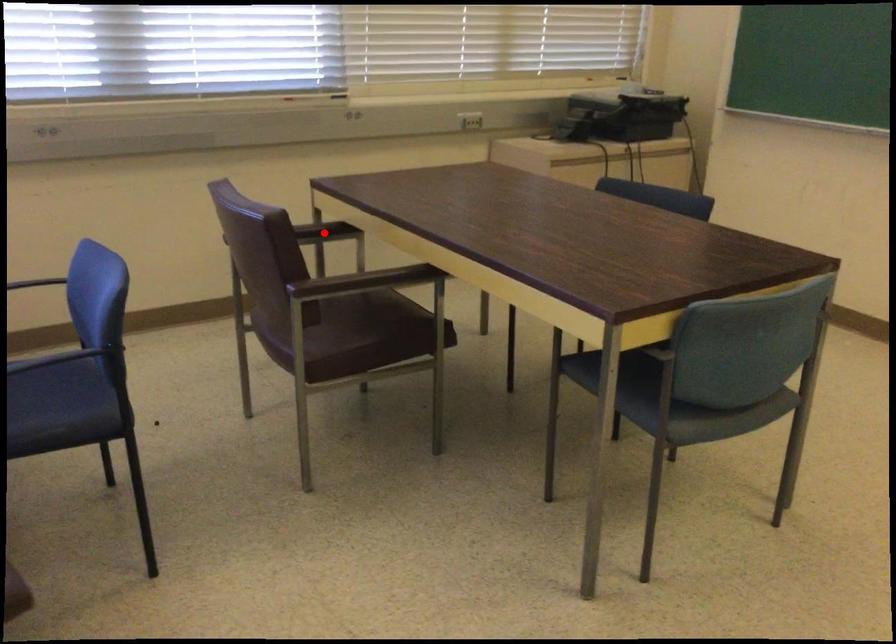
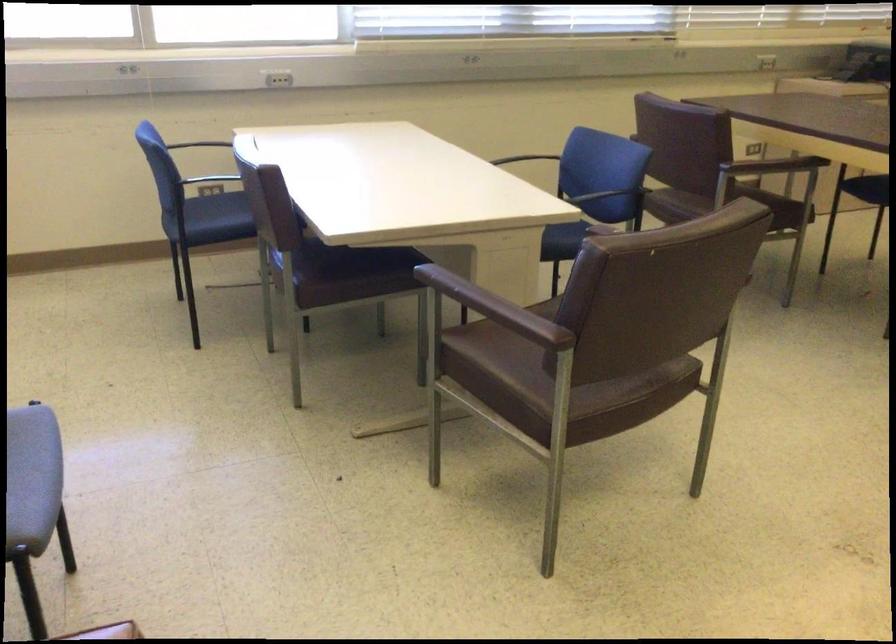
Question: I am providing you with two images of the same scene from different viewpoints. A red point is marked on the first image. Is the red point's position out of view in image 2?

Choices:
 (A) Yes
 (B) No

Answer: (A)